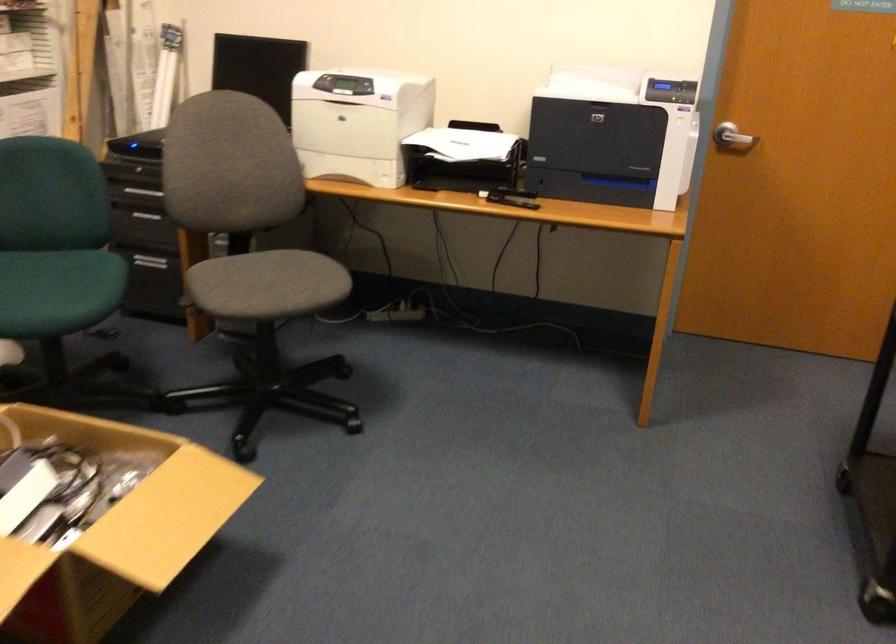
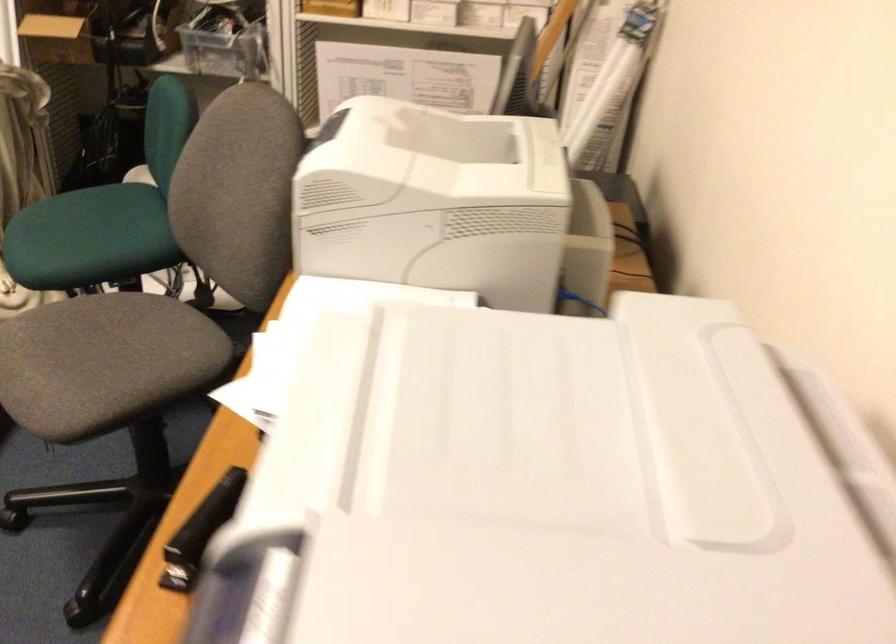
In the second image, find the point that corresponds to point 291,268 in the first image.

(105, 363)